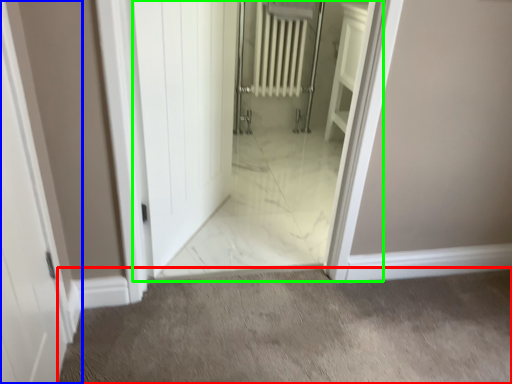
Question: Which object is the farthest from granite (highlighted by a red box)? Choose among these: door (highlighted by a blue box) or elevator (highlighted by a green box).

Choices:
 (A) door
 (B) elevator

Answer: (B)